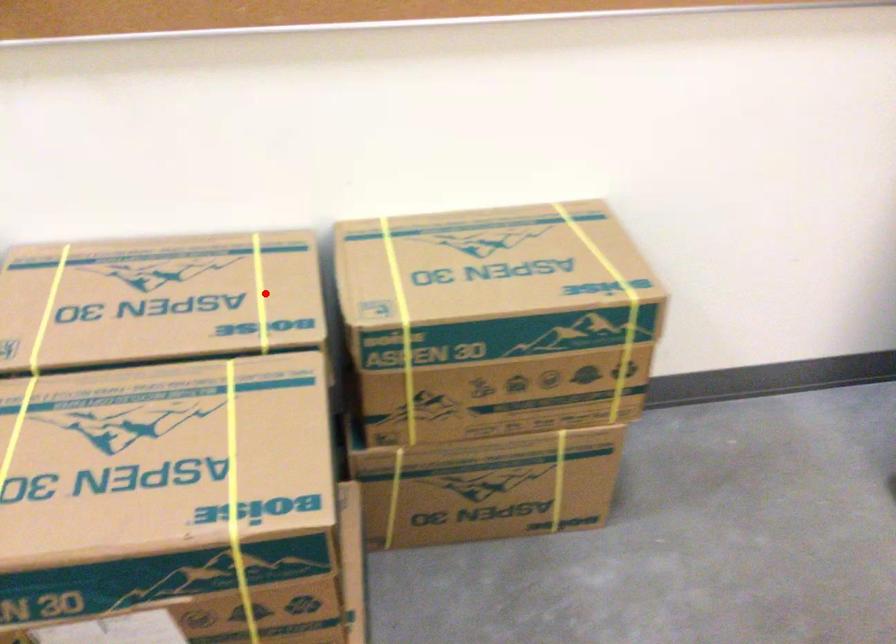
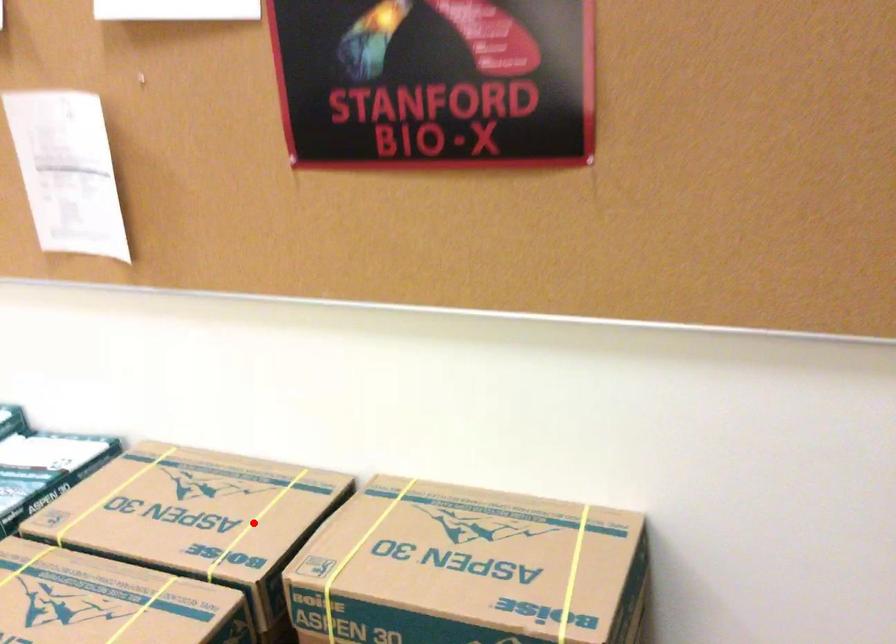
I am providing you with two images of the same scene from different viewpoints. A red point is marked on the first image and another point is marked on the second image. Does the point marked in image1 correspond to the same location as the one in image2?

Yes